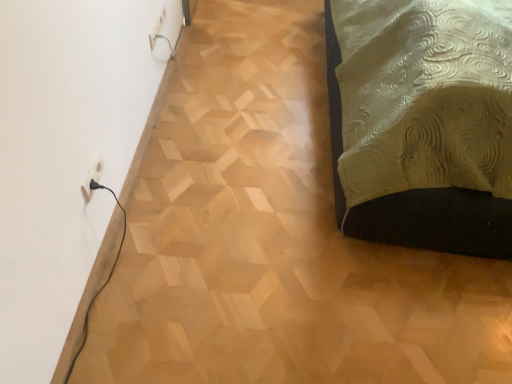
The width and height of the screenshot is (512, 384). What do you see at coordinates (92, 176) in the screenshot? I see `white plastic outlet at lower left` at bounding box center [92, 176].

Find the location of a particular element. This screenshot has height=384, width=512. white plastic outlet at lower left is located at coordinates (92, 176).

Identify the location of white plastic outlet at lower left. (92, 176).